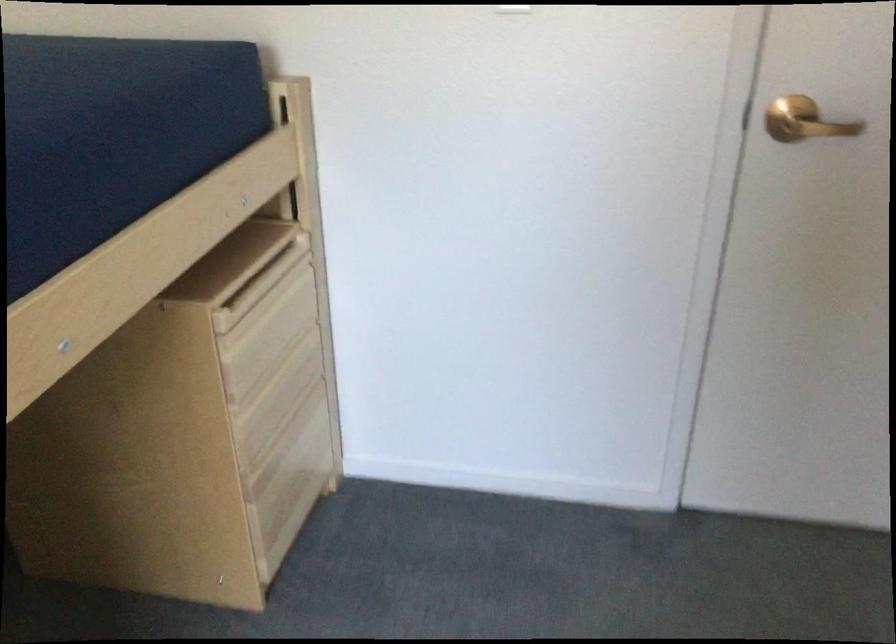
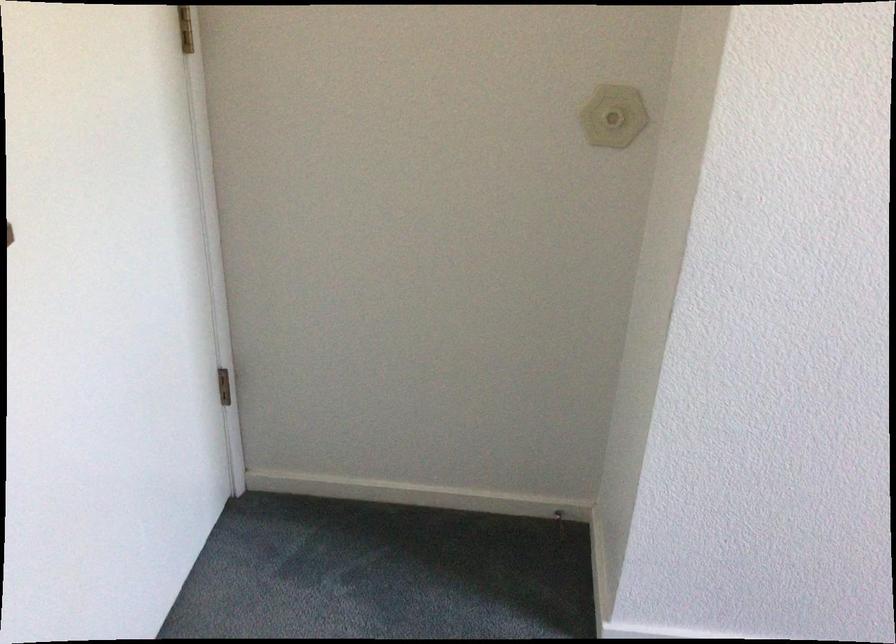
Based on the continuous images, in which direction is the camera rotating?

The camera's rotation is toward right-down.